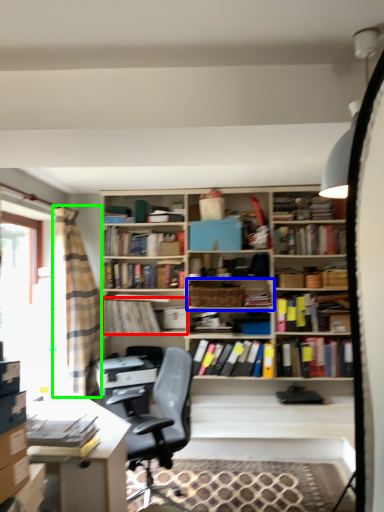
Question: Considering the real-world distances, which object is farthest from book (highlighted by a red box)? shelf (highlighted by a blue box) or curtain (highlighted by a green box)?

Choices:
 (A) shelf
 (B) curtain

Answer: (A)